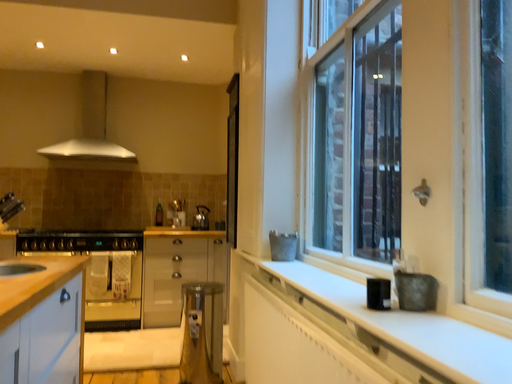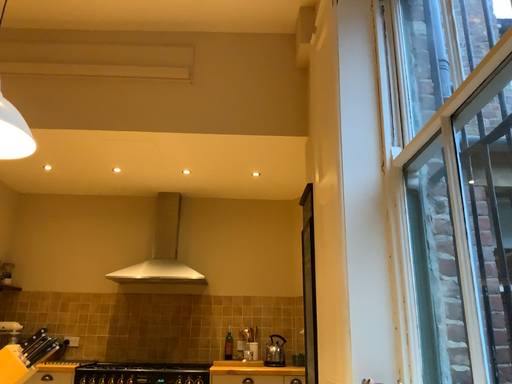
Question: Which way did the camera rotate in the video?

Choices:
 (A) rotated downward
 (B) rotated upward

Answer: (B)